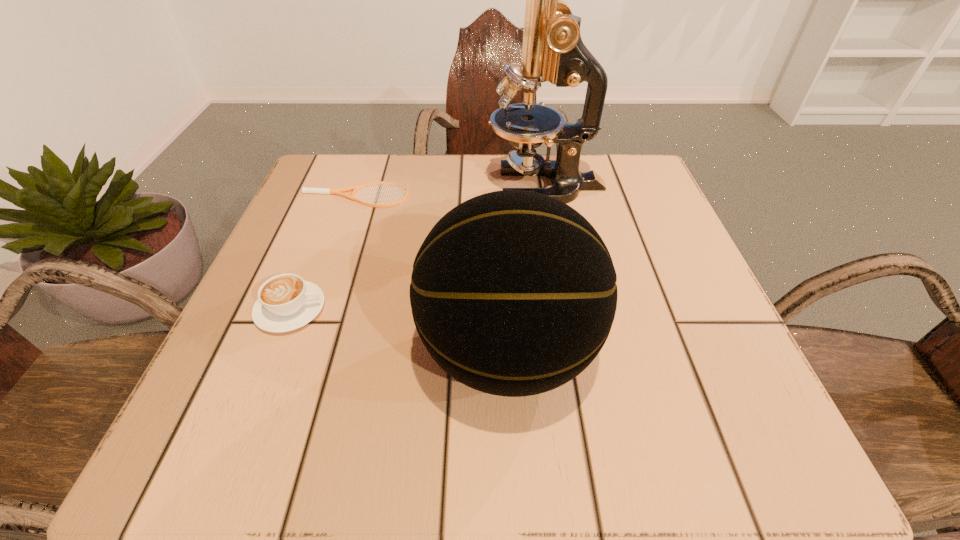
This screenshot has width=960, height=540. In the image, there is a desktop. Find the location of `free region at the right edge`. free region at the right edge is located at coordinates (635, 349).

Where is `vacant space at the far left corner of the desktop`? vacant space at the far left corner of the desktop is located at coordinates (341, 153).

This screenshot has height=540, width=960. In the image, there is a desktop. What are the coordinates of `vacant area at the far right corner` in the screenshot? It's located at (628, 180).

Where is `vacant space at the near right corner of the desktop`? The height and width of the screenshot is (540, 960). vacant space at the near right corner of the desktop is located at coordinates (756, 460).

The width and height of the screenshot is (960, 540). Find the location of `vacant space that is in between the microscope and the tennis racket`. vacant space that is in between the microscope and the tennis racket is located at coordinates (450, 191).

Identify the location of vacant point located between the tennis racket and the tallest object. Image resolution: width=960 pixels, height=540 pixels. (450, 191).

At what (x,y) coordinates should I click in order to perform the action: click on vacant region between the second tallest object and the cappuccino. Please return your answer as a coordinate pair (x, y). The width and height of the screenshot is (960, 540). Looking at the image, I should click on (399, 330).

The height and width of the screenshot is (540, 960). I want to click on free space that is in between the shortest object and the tallest object, so click(x=450, y=191).

At what (x,y) coordinates should I click in order to perform the action: click on object that is the third closest to the tennis racket. Please return your answer as a coordinate pair (x, y). The image size is (960, 540). Looking at the image, I should click on (513, 293).

Where is `object that is the second closest one to the basketball`? The height and width of the screenshot is (540, 960). object that is the second closest one to the basketball is located at coordinates (552, 49).